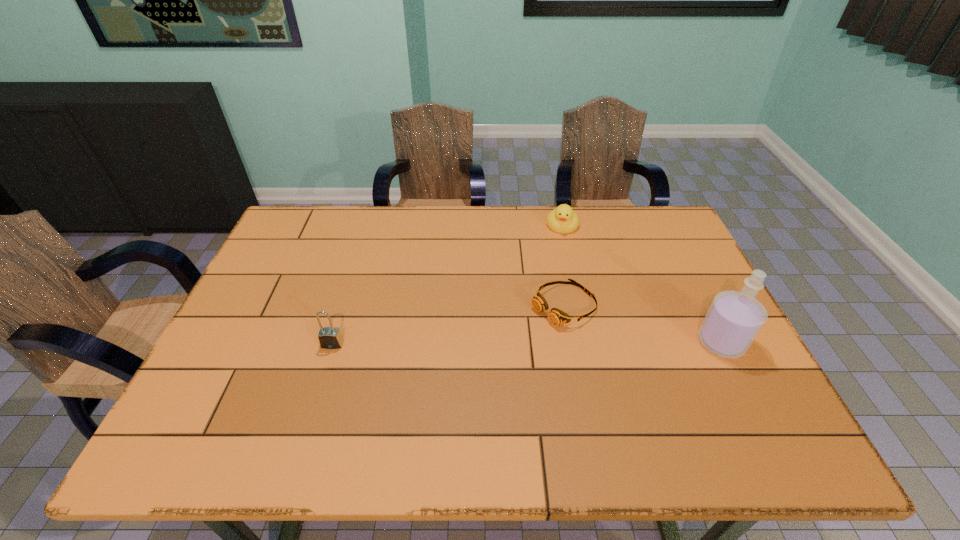
Find the location of a particular element. This screenshot has width=960, height=540. vacant space on the desktop that is between the leftmost object and the tallest object and is positioned on the face of the second shortest object is located at coordinates (543, 343).

Find the location of `free space on the desktop that is between the padlock and the perfume and is positioned with the lenses facing forward on the shortest object`. free space on the desktop that is between the padlock and the perfume and is positioned with the lenses facing forward on the shortest object is located at coordinates (503, 343).